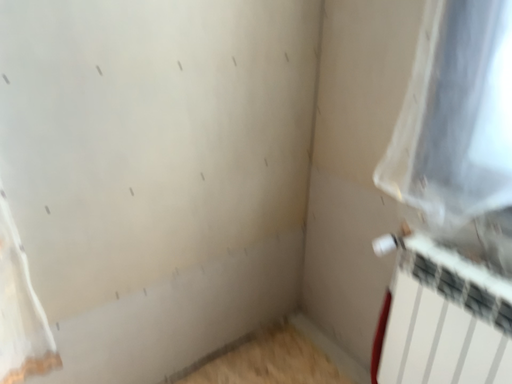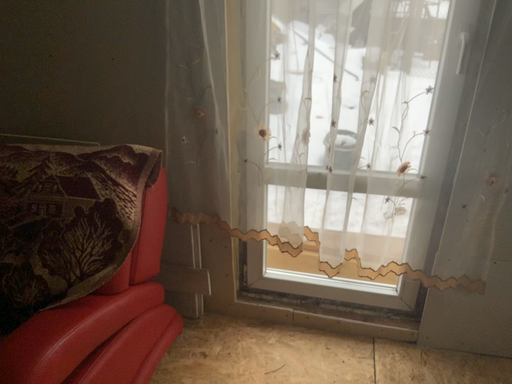
Question: How did the camera likely rotate when shooting the video?

Choices:
 (A) rotated left
 (B) rotated right

Answer: (A)